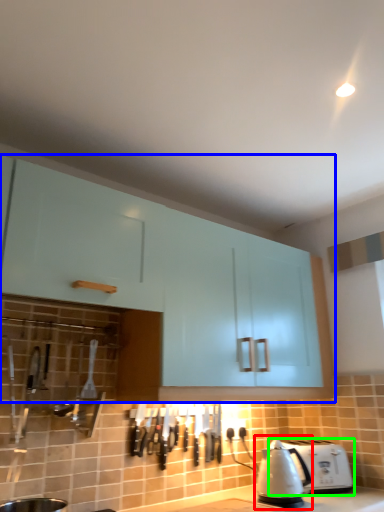
Question: Based on their relative distances, which object is farther from kettle (highlighted by a red box)? Choose from cabinetry (highlighted by a blue box) and toaster (highlighted by a green box).

Choices:
 (A) cabinetry
 (B) toaster

Answer: (A)